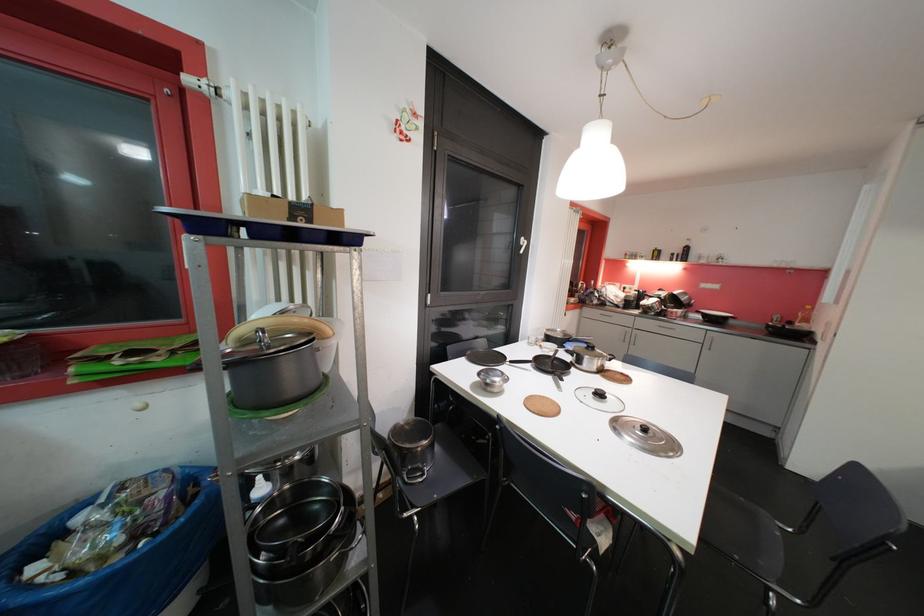
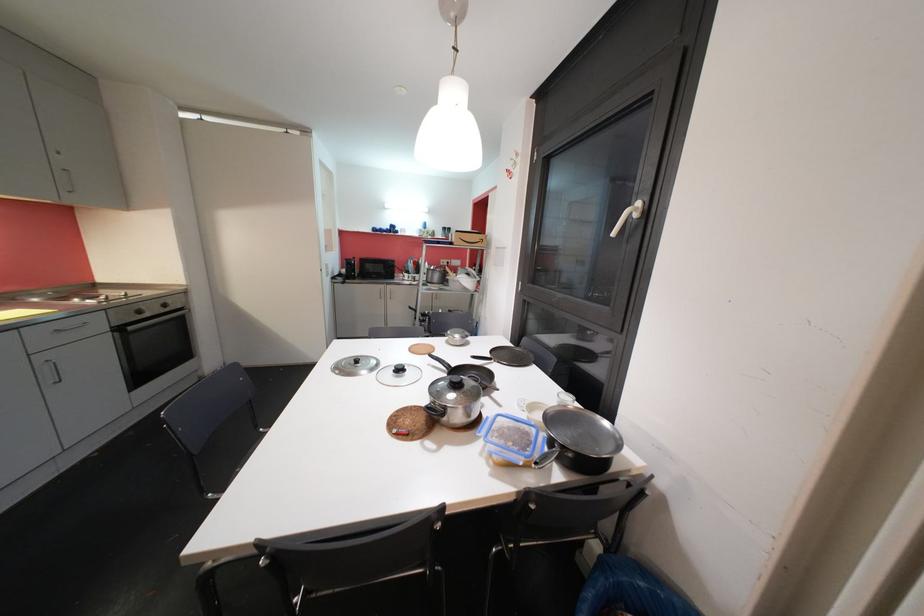
Locate, in the second image, the point that corresponds to pixel 604 397 in the first image.

(405, 371)